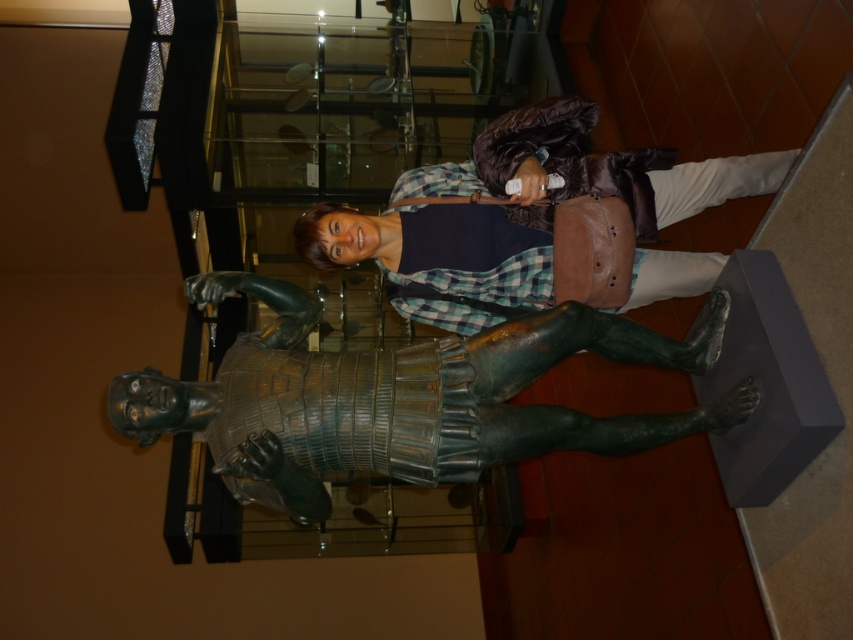
Is point (280, 499) less distant than point (309, 225)?

That is True.

Does point (465, 400) come behind point (294, 237)?

No, it is not.

Does point (245, 371) lie in front of point (547, 145)?

Yes, it is.

I want to click on green patinated bronze statue at center, so (405, 397).